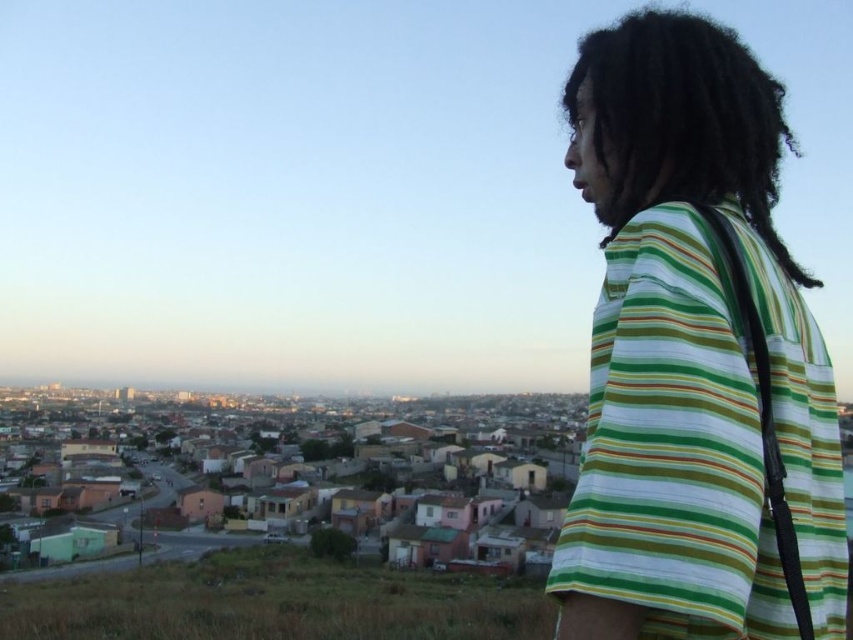
You are a photographer standing at the center of the scene. You want to take a photo that includes both the green striped shirt at right and the black curly hair at upper right. What is the minimum distance you need to move forward to ensure both are in frame?

The minimum distance you need to move forward is 7.17 meters to ensure both the green striped shirt at right and the black curly hair at upper right are in frame.

You are a photographer trying to capture the scene from the current viewpoint. You want to ensure both the green striped shirt at right and the black curly hair at upper right are in focus. Which object should you adjust your camera focus to prioritize first?

The green striped shirt at right is closer to the viewer than the black curly hair at upper right. To ensure both are in focus, prioritize focusing on the green striped shirt at right first, as it is nearer and adjusting focus for closer objects can help maintain clarity for the farther one.

You are a photographer trying to capture the person in the image. The person is wearing a green striped shirt at right and has black curly hair at upper right. Which part of the person should you focus on to ensure the entire subject is in frame?

The green striped shirt at right is positioned on the right side of black curly hair at upper right. To ensure the entire subject is in frame, focus on the center point between the green striped shirt at right and the black curly hair at upper right.